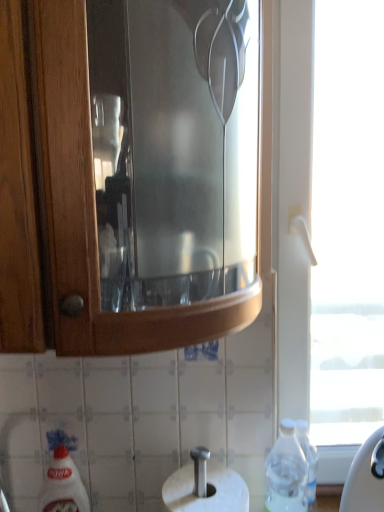
Question: Is transparent plastic bottle at lower right positioned with its back to transparent glass window at right?

Choices:
 (A) yes
 (B) no

Answer: (B)

Question: Is transparent glass window at right completely or partially inside transparent plastic bottle at lower right?

Choices:
 (A) yes
 (B) no

Answer: (B)

Question: From the image's perspective, is transparent plastic bottle at lower right on top of transparent glass window at right?

Choices:
 (A) no
 (B) yes

Answer: (A)

Question: Considering the relative sizes of transparent plastic bottle at lower right and transparent glass window at right in the image provided, is transparent plastic bottle at lower right wider than transparent glass window at right?

Choices:
 (A) no
 (B) yes

Answer: (B)

Question: Considering the relative sizes of transparent plastic bottle at lower right and transparent glass window at right in the image provided, is transparent plastic bottle at lower right shorter than transparent glass window at right?

Choices:
 (A) no
 (B) yes

Answer: (B)

Question: Is white glossy bottle at lower left in front of or behind transparent glass window at right in the image?

Choices:
 (A) behind
 (B) front

Answer: (B)

Question: From the image's perspective, relative to transparent glass window at right, is white glossy bottle at lower left above or below?

Choices:
 (A) above
 (B) below

Answer: (B)

Question: Choose the correct answer: Is white glossy bottle at lower left inside transparent glass window at right or outside it?

Choices:
 (A) outside
 (B) inside

Answer: (A)

Question: From a real-world perspective, is white glossy bottle at lower left positioned above or below transparent glass window at right?

Choices:
 (A) above
 (B) below

Answer: (B)

Question: Is transparent plastic bottle at lower right to the left or to the right of white glossy bottle at lower left in the image?

Choices:
 (A) left
 (B) right

Answer: (B)

Question: Does point (278, 501) appear closer or farther from the camera than point (82, 482)?

Choices:
 (A) farther
 (B) closer

Answer: (B)

Question: Would you say transparent plastic bottle at lower right is inside or outside white glossy bottle at lower left?

Choices:
 (A) outside
 (B) inside

Answer: (A)

Question: In terms of height, does transparent plastic bottle at lower right look taller or shorter compared to white glossy bottle at lower left?

Choices:
 (A) tall
 (B) short

Answer: (B)

Question: In terms of width, does transparent plastic bottle at lower right look wider or thinner when compared to transparent glass window at right?

Choices:
 (A) wide
 (B) thin

Answer: (A)

Question: Considering their positions, is transparent plastic bottle at lower right located in front of or behind transparent glass window at right?

Choices:
 (A) behind
 (B) front

Answer: (B)